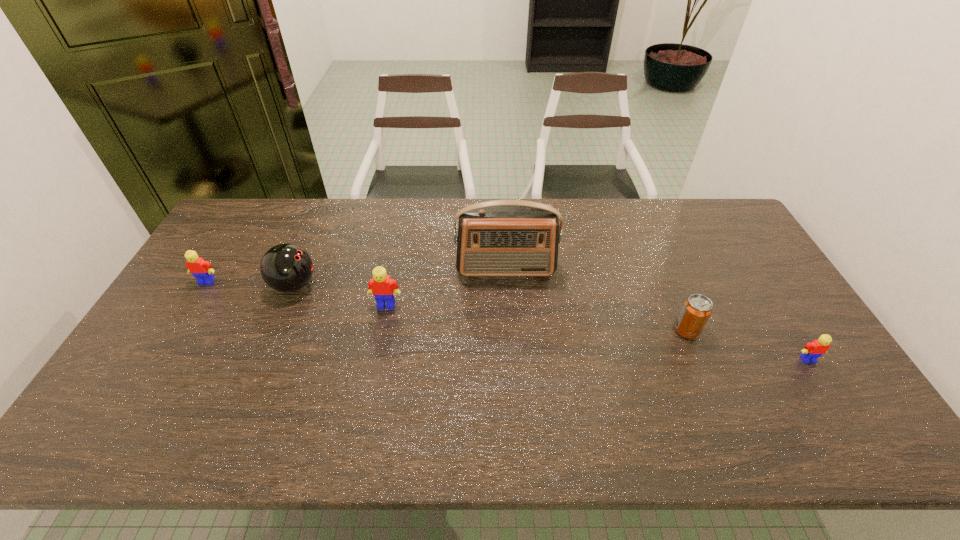
I want to click on vacant space at the near edge, so click(x=249, y=381).

What are the coordinates of `free space at the right edge of the desktop` in the screenshot? It's located at (760, 353).

Find the location of a particular element. free point at the far left corner is located at coordinates (235, 209).

Locate an element on the screen. This screenshot has height=540, width=960. free space at the far right corner of the desktop is located at coordinates (679, 200).

Locate an element on the screen. The width and height of the screenshot is (960, 540). vacant area at the near right corner is located at coordinates (809, 399).

Where is `vacant area that lies between the second shortest Lego and the rightmost object`? vacant area that lies between the second shortest Lego and the rightmost object is located at coordinates (507, 321).

Find the location of a particular element. free space between the fifth farthest object and the leftmost object is located at coordinates (446, 306).

Identify the location of vacant space that is in between the third object from right to left and the third object from left to right. (446, 287).

I want to click on blank region between the second object from right to left and the tallest Lego, so point(537,318).

Where is `empty location between the bowling ball and the leftmost object`? empty location between the bowling ball and the leftmost object is located at coordinates (251, 284).